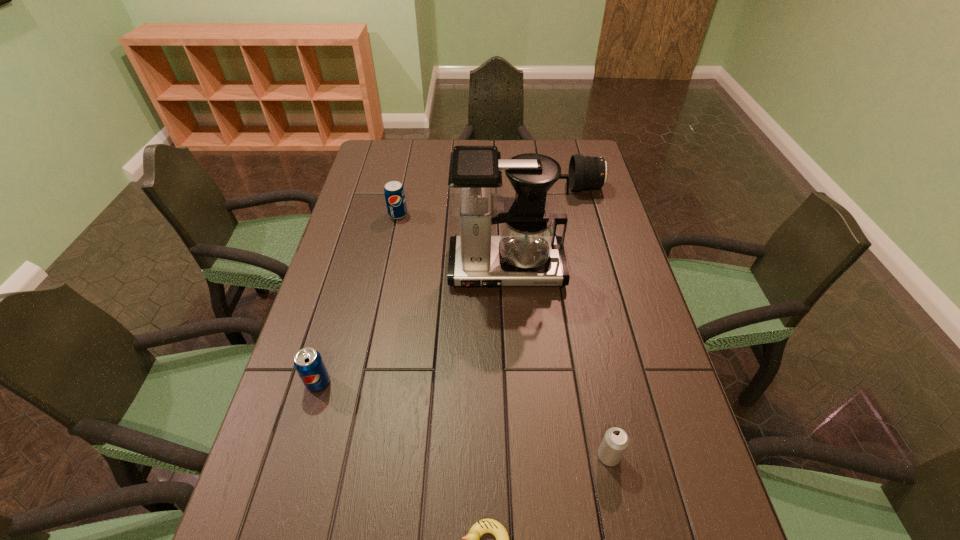
You are a GUI agent. You are given a task and a screenshot of the screen. Output one action in this format:
    pyautogui.click(x=<x>, y=<y>)
    Task: Click on the tallest object
    Image resolution: width=960 pixels, height=540 pixels.
    Given the screenshot: What is the action you would take?
    pyautogui.click(x=528, y=252)

The height and width of the screenshot is (540, 960). I want to click on the fourth nearest object, so click(x=528, y=252).

The width and height of the screenshot is (960, 540). I want to click on the rightmost object, so click(587, 172).

Image resolution: width=960 pixels, height=540 pixels. In order to click on the farthest object in this screenshot , I will do `click(587, 172)`.

This screenshot has height=540, width=960. I want to click on the farther pop soda, so click(394, 193).

Locate an element on the screen. This screenshot has height=540, width=960. the second farthest object is located at coordinates (394, 193).

Where is `the nearer pop soda`? the nearer pop soda is located at coordinates (308, 362).

Image resolution: width=960 pixels, height=540 pixels. Find the location of `the left pop soda`. the left pop soda is located at coordinates (308, 362).

This screenshot has width=960, height=540. I want to click on the fifth farthest object, so click(615, 442).

The height and width of the screenshot is (540, 960). Identify the location of the second shortest object. (615, 442).